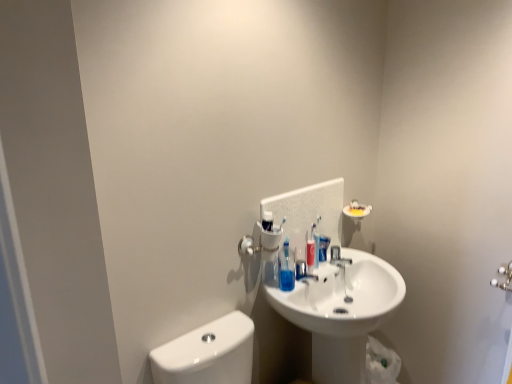
Question: From the image's perspective, relative to blue glossy mouthwash at center, is white glossy sink at center above or below?

Choices:
 (A) above
 (B) below

Answer: (B)

Question: Is point (394, 288) closer or farther from the camera than point (323, 243)?

Choices:
 (A) farther
 (B) closer

Answer: (B)

Question: Estimate the real-world distances between objects in this image. Which object is closer to the translucent plastic soap dispenser at center?

Choices:
 (A) blue glossy mouthwash at center
 (B) satin nickel faucet at center
 (C) white glossy sink at center

Answer: (A)

Question: Which is nearer to the white glossy sink at center?

Choices:
 (A) satin nickel faucet at center
 (B) translucent plastic soap dispenser at center
 (C) blue glossy mouthwash at center

Answer: (B)